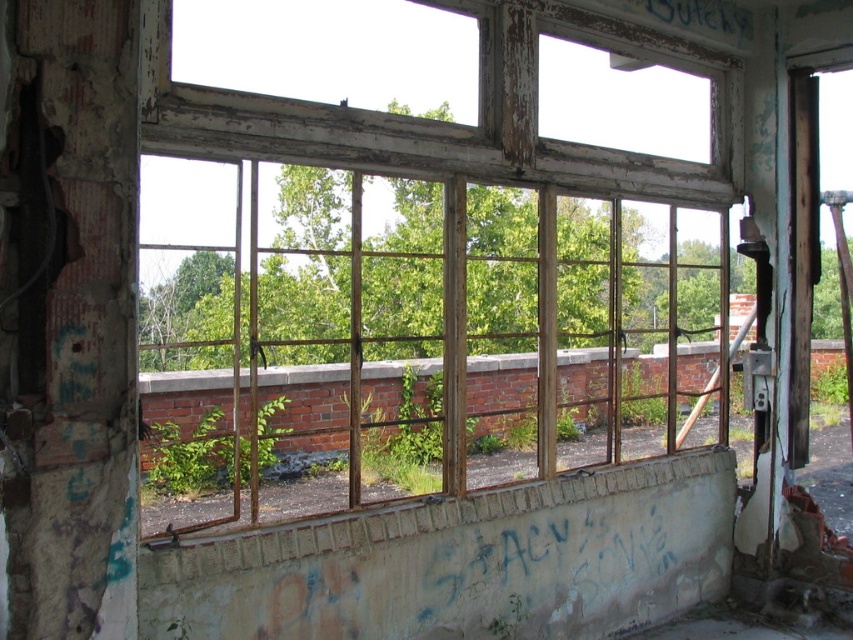
Consider the image. You are a maintenance worker assessing the interior space. You notice the weathered wood window frame at center and the green leafy plant at center. Which object is positioned higher from the floor?

The weathered wood window frame at center is located above the green leafy plant at center, so the window frame is higher up from the floor.

You are an interior designer assessing the space. You notice the weathered wood window frame at center and the green leafy plant at center. Which object occupies more space in the scene?

The weathered wood window frame at center is bigger than the green leafy plant at center, so it occupies more space in the scene.

You are a painter who wants to paint the weathered wood window frame at center and the green leafy plant at center. Which object is taller?

The weathered wood window frame at center is taller than the green leafy plant at center.